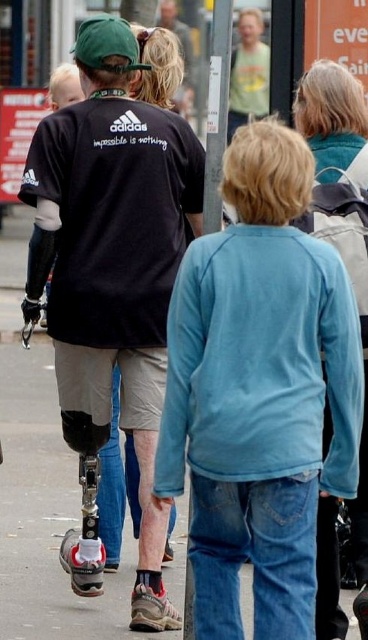
Question: Which object appears farthest from the camera in this image?

Choices:
 (A) green cotton shirt at upper center
 (B) matte black t-shirt at center

Answer: (B)

Question: Which object is farther from the camera taking this photo?

Choices:
 (A) matte blue sweatshirt at center
 (B) green cotton shirt at upper center

Answer: (B)

Question: Which of the following is the closest to the observer?

Choices:
 (A) (210, 314)
 (B) (238, 35)

Answer: (A)

Question: Does matte blue sweatshirt at center appear on the right side of matte black t-shirt at center?

Choices:
 (A) no
 (B) yes

Answer: (B)

Question: Is matte black t-shirt at center smaller than green cotton shirt at upper center?

Choices:
 (A) no
 (B) yes

Answer: (B)

Question: Can you confirm if matte black t-shirt at center is bigger than green cotton shirt at upper center?

Choices:
 (A) no
 (B) yes

Answer: (A)